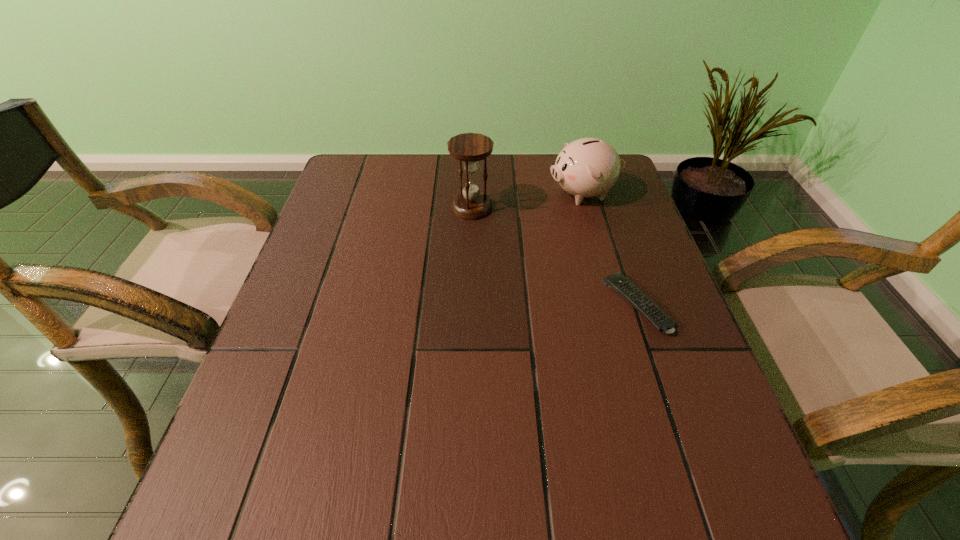
The height and width of the screenshot is (540, 960). I want to click on empty space between the piggy bank and the shortest object, so click(611, 249).

Identify the location of vacant point located between the second tallest object and the nearest object. (611, 249).

Find the location of a particular element. The width and height of the screenshot is (960, 540). vacant space in between the piggy bank and the hourglass is located at coordinates (528, 200).

You are a GUI agent. You are given a task and a screenshot of the screen. Output one action in this format:
    pyautogui.click(x=<x>, y=<y>)
    Task: Click on the vacant space that is in between the tallest object and the remote control
    This screenshot has width=960, height=540.
    Given the screenshot: What is the action you would take?
    pyautogui.click(x=554, y=256)

This screenshot has width=960, height=540. Find the location of `free spot between the piggy bank and the remote control`. free spot between the piggy bank and the remote control is located at coordinates coord(611,249).

The image size is (960, 540). I want to click on free space between the tallest object and the second shortest object, so click(528, 200).

Locate an element on the screen. The height and width of the screenshot is (540, 960). unoccupied position between the shortest object and the piggy bank is located at coordinates (611, 249).

What are the coordinates of `object that stands as the closest to the nearest object` in the screenshot? It's located at (587, 167).

Find the location of `object that stands as the second closest to the piggy bank`. object that stands as the second closest to the piggy bank is located at coordinates (618, 282).

The image size is (960, 540). Identify the location of free region that satisfies the following two spatial constraints: 1. on the back side of the tallest object; 2. on the right side of the piggy bank. (471, 194).